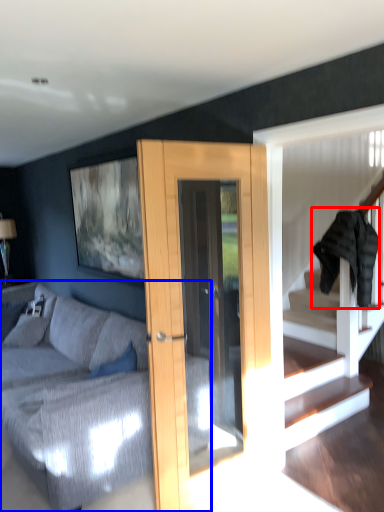
Question: Which of the following is the farthest to the observer, clothe (highlighted by a red box) or studio couch (highlighted by a blue box)?

Choices:
 (A) clothe
 (B) studio couch

Answer: (A)